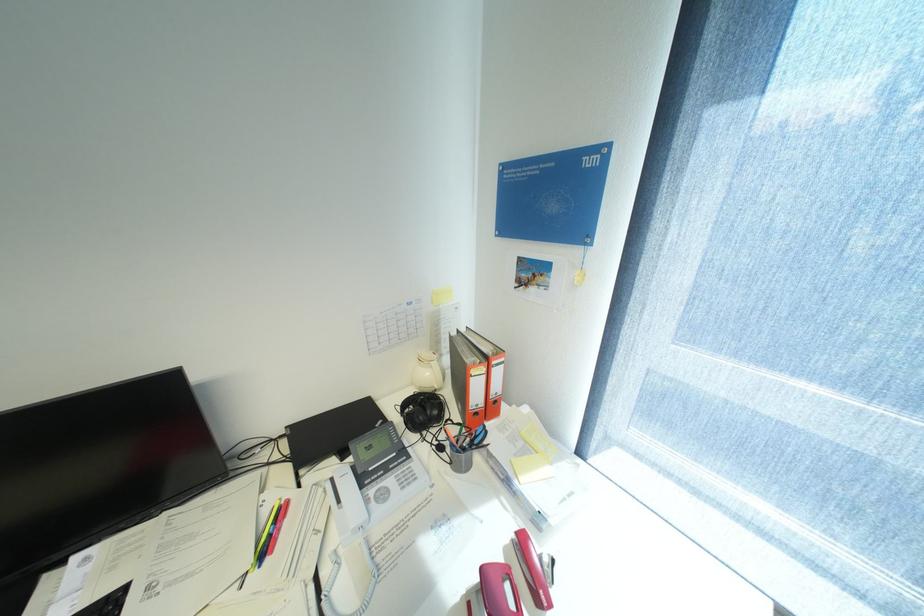
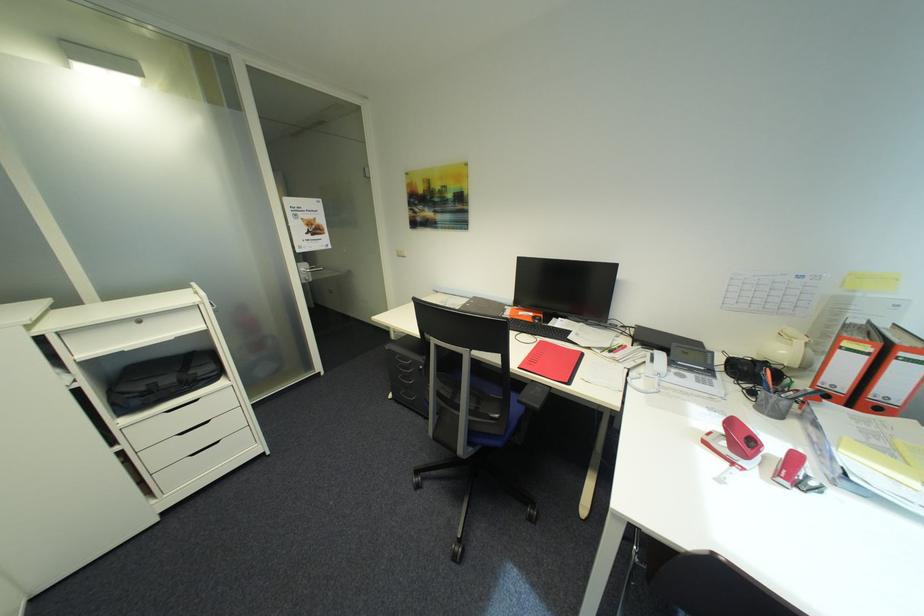
Locate, in the second image, the point that corresponds to the point at 505,374 in the first image.

(912, 371)